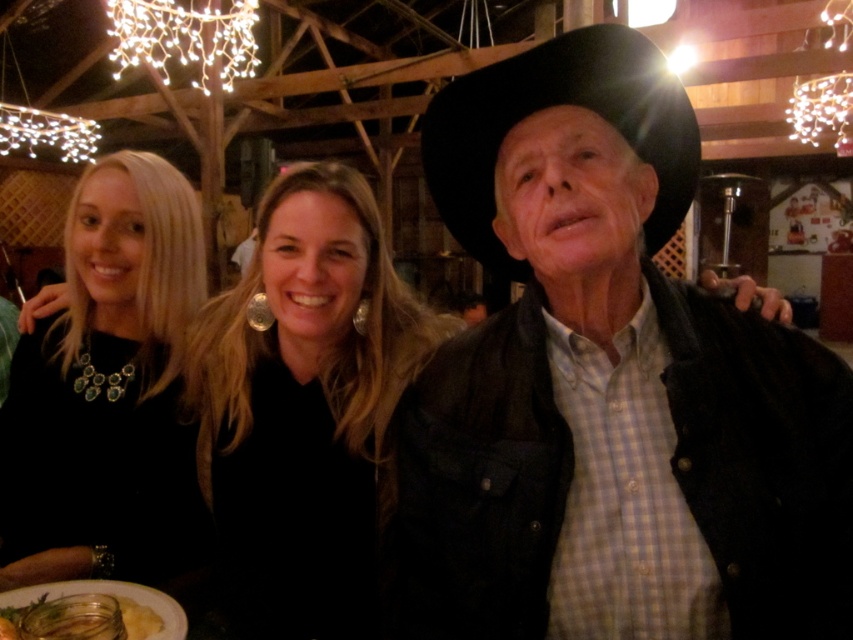
Is the position of black matte necklace at left less distant than that of translucent glass plate at lower left?

No, black matte necklace at left is behind translucent glass plate at lower left.

Does point (184, 280) lie behind point (19, 612)?

Yes, point (184, 280) is farther from viewer.

Where is `black matte necklace at left`? black matte necklace at left is located at coordinates (108, 392).

Does black matte necklace at left have a larger size compared to black felt cowboy hat at center?

Yes, black matte necklace at left is bigger than black felt cowboy hat at center.

Which is above, black matte necklace at left or black felt cowboy hat at center?

black felt cowboy hat at center

Which is in front, point (78, 490) or point (651, 42)?

Point (651, 42)

Where is `black matte necklace at left`? black matte necklace at left is located at coordinates click(x=108, y=392).

Which of these two, black fabric at center or translucent glass plate at lower left, stands shorter?

With less height is translucent glass plate at lower left.

Who is higher up, black fabric at center or translucent glass plate at lower left?

black fabric at center is higher up.

Does point (384, 488) lie behind point (9, 611)?

Yes, it is.

The width and height of the screenshot is (853, 640). What are the coordinates of `black fabric at center` in the screenshot? It's located at (305, 404).